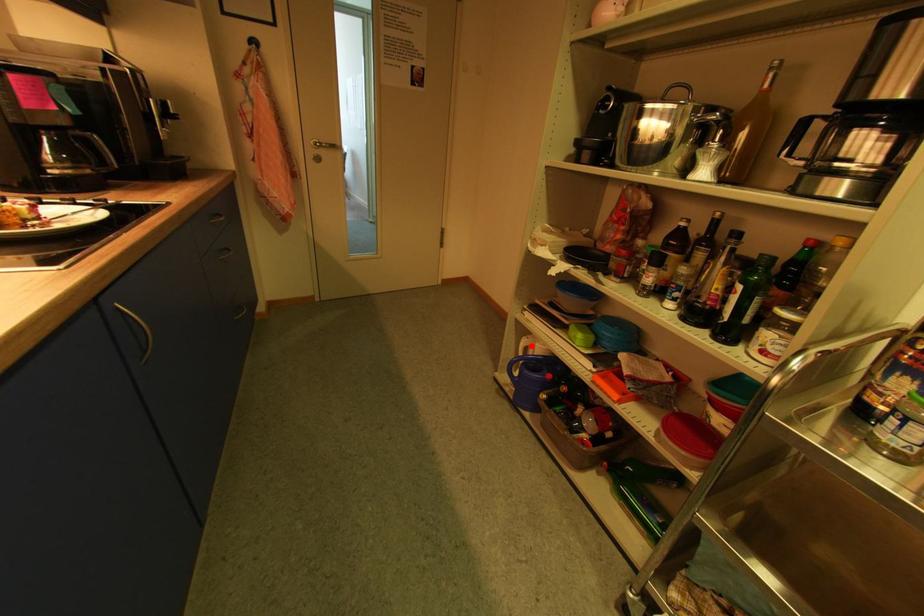
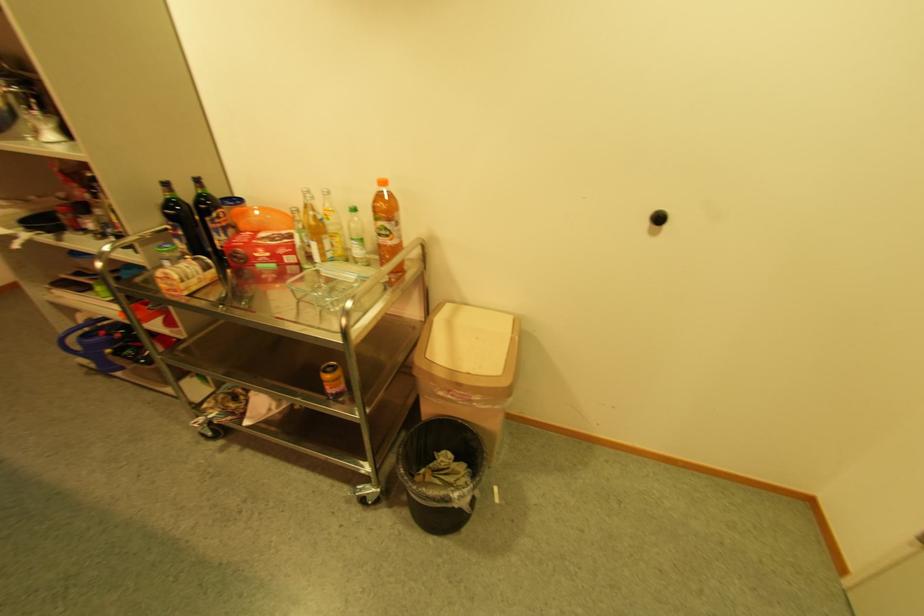
Question: I am providing you with two images of the same scene from different viewpoints. Given a red point in image1, look at the same physical point in image2. Is it:

Choices:
 (A) Closer to the viewpoint
 (B) Farther from the viewpoint

Answer: (B)